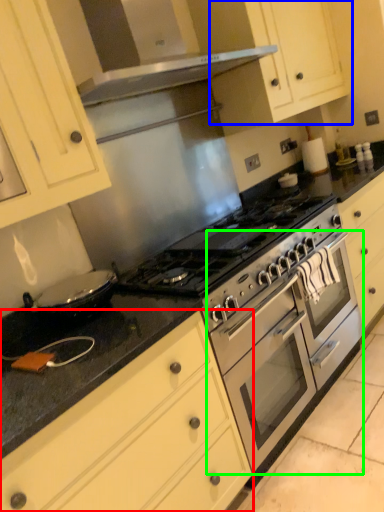
Question: Estimate the real-world distances between objects in this image. Which object is closer to cabinetry (highlighted by a red box), cabinetry (highlighted by a blue box) or oven (highlighted by a green box)?

Choices:
 (A) cabinetry
 (B) oven

Answer: (B)